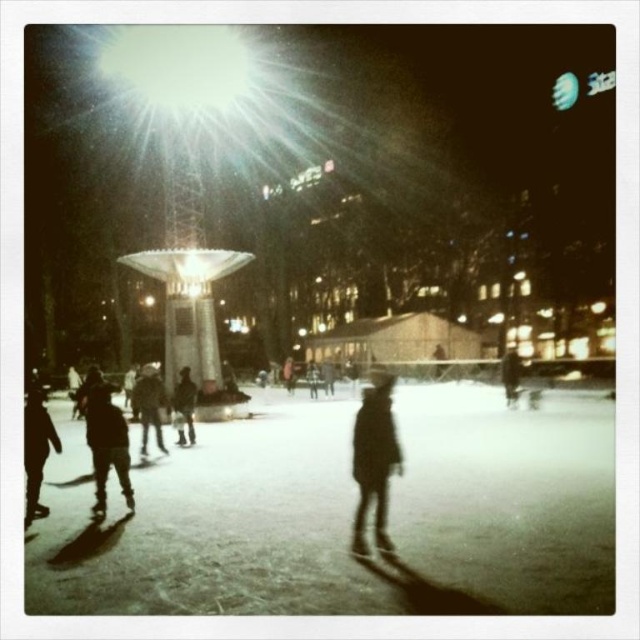
Based on the photo, you are an observer standing at the edge of the skating rink. You notice two figures in the scene, one wearing a dark textured coat at center and another in dark matte clothing at lower left. Which of these two figures has a narrower silhouette?

The dark textured coat at center is thinner than the dark matte clothing at lower left, so the figure in the dark textured coat at center has a narrower silhouette.

You are standing at the center of the skating rink and want to locate the dark matte clothing at lower left. Based on the coordinates provided, in which direction should you look to find it?

You should look to the lower left direction to find the dark matte clothing at lower left, as it is located at point 0.706 on the x axis and 0.058 on the y axis.

You are an observer standing at the edge of the skating rink. You notice two items at the center of the image, the dark woolen hat at center and the dark brown leather jacket at center. Which item is closer to the ground?

The dark woolen hat at center is positioned under the dark brown leather jacket at center, so it is closer to the ground.